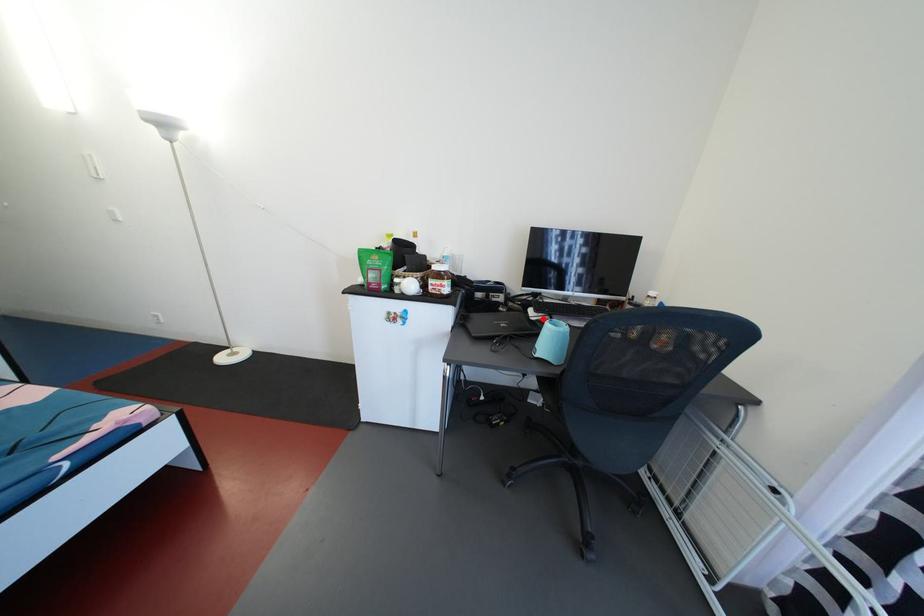
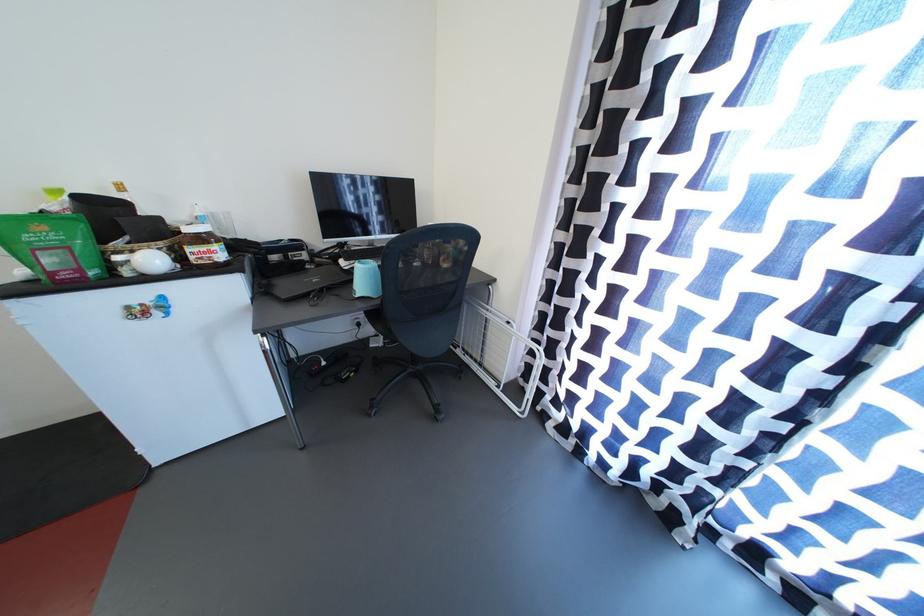
In the second image, find the point that corresponds to the highlighted location in the first image.

(354, 268)